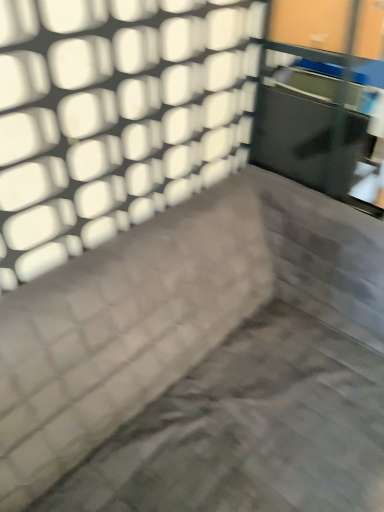
Question: Is point (148, 360) closer or farther from the camera than point (342, 144)?

Choices:
 (A) closer
 (B) farther

Answer: (A)

Question: From their relative heights in the image, would you say dark gray fabric couch at center is taller or shorter than transparent glass door at upper right?

Choices:
 (A) short
 (B) tall

Answer: (B)

Question: From the image's perspective, is dark gray fabric couch at center above or below transparent glass door at upper right?

Choices:
 (A) below
 (B) above

Answer: (A)

Question: Would you say transparent glass door at upper right is inside or outside dark gray fabric couch at center?

Choices:
 (A) inside
 (B) outside

Answer: (B)

Question: Considering the positions of transparent glass door at upper right and dark gray fabric couch at center in the image, is transparent glass door at upper right bigger or smaller than dark gray fabric couch at center?

Choices:
 (A) big
 (B) small

Answer: (B)

Question: Considering the positions of transparent glass door at upper right and dark gray fabric couch at center in the image, is transparent glass door at upper right wider or thinner than dark gray fabric couch at center?

Choices:
 (A) wide
 (B) thin

Answer: (B)

Question: From their relative heights in the image, would you say transparent glass door at upper right is taller or shorter than dark gray fabric couch at center?

Choices:
 (A) tall
 (B) short

Answer: (B)